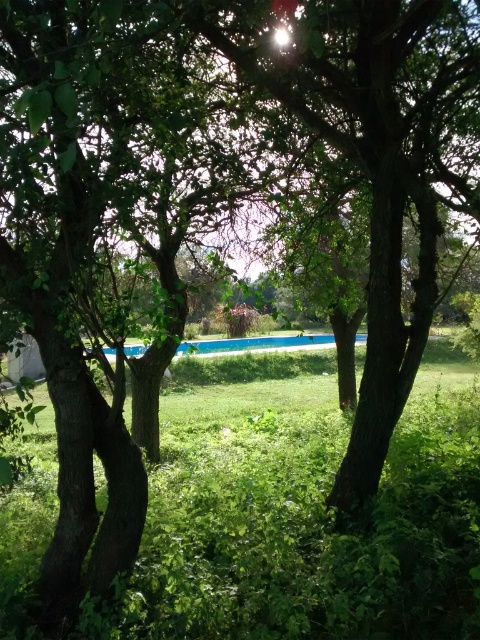
Question: Can you confirm if green leafy grass at center is thinner than blue smooth pool at center?

Choices:
 (A) no
 (B) yes

Answer: (B)

Question: Can you confirm if green leafy grass at center is bigger than blue smooth pool at center?

Choices:
 (A) no
 (B) yes

Answer: (A)

Question: Among these objects, which one is farthest from the camera?

Choices:
 (A) green leafy grass at center
 (B) blue smooth pool at center

Answer: (A)

Question: Which point is farther from the camera taking this photo?

Choices:
 (A) (86, 353)
 (B) (243, 410)

Answer: (B)

Question: Does green leafy grass at center appear on the left side of blue smooth pool at center?

Choices:
 (A) yes
 (B) no

Answer: (B)

Question: Which of the following is the closest to the observer?

Choices:
 (A) (333, 336)
 (B) (456, 499)

Answer: (B)